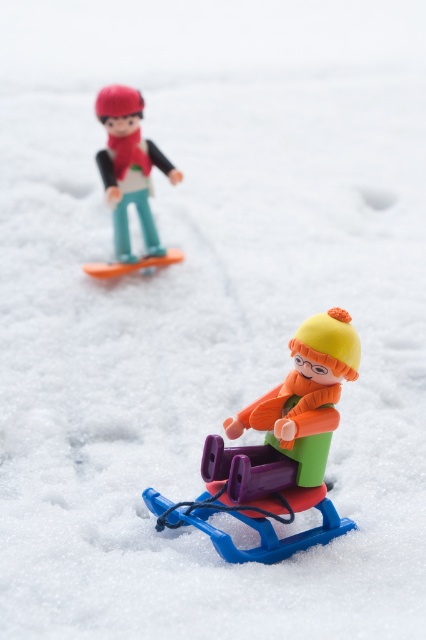
Looking at this image, you are a parent setting up a toy display. You want to arrange the matte plastic sled at lower center and the matte plastic skier at upper left in a way that follows the original image. Which toy should be placed to the right of the other?

The matte plastic sled at lower center should be placed to the right of the matte plastic skier at upper left because in the original image, the matte plastic sled at lower center is positioned on the right side of the matte plastic skier at upper left.

You are a child who wants to reach the matte plastic sled at lower center. If your hand can extend 30 inches forward, will you be able to touch it?

The distance between the matte plastic sled at lower center and the viewer is 36.34 inches, which is farther than the 30 inches your hand can reach. Therefore, you cannot touch the sled.

Based on the photo, you are organizing a toy storage box and need to decide whether the matte plastic sled at lower center and the matte plastic skier at upper left can fit side by side. Based on their sizes, will they both fit if the box has enough space?

The matte plastic sled at lower center occupies less space than the matte plastic skier at upper left, so if the box has enough space to accommodate both, they can fit side by side since the sled takes up less area than the skier.